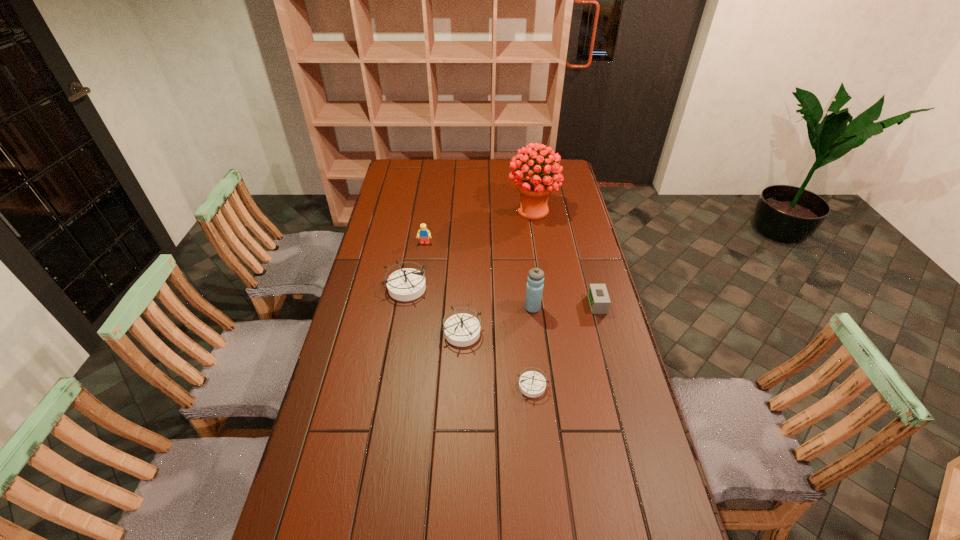
Identify the location of free region located on the front of the farthest compass. (396, 336).

Identify the location of free spot located 0.050m on the back of the fifth object from right to left. The height and width of the screenshot is (540, 960). (463, 306).

This screenshot has width=960, height=540. In order to click on free region located 0.250m on the left of the rightmost compass in this screenshot , I will do `click(434, 385)`.

This screenshot has width=960, height=540. What are the coordinates of `vacant space situated on the back of the bouquet` in the screenshot? It's located at (527, 177).

Where is `vacant space located on the front-facing side of the second farthest object`? The image size is (960, 540). vacant space located on the front-facing side of the second farthest object is located at coordinates (420, 279).

In order to click on vacant space situated on the front-facing side of the rightmost object in this screenshot , I will do `click(486, 305)`.

You are a GUI agent. You are given a task and a screenshot of the screen. Output one action in this format:
    pyautogui.click(x=<x>, y=<y>)
    Task: Click on the vacant area situated 0.130m on the front-facing side of the rightmost object
    This screenshot has height=540, width=960.
    Given the screenshot: What is the action you would take?
    pyautogui.click(x=553, y=305)

You are a GUI agent. You are given a task and a screenshot of the screen. Output one action in this format:
    pyautogui.click(x=<x>, y=<y>)
    Task: Click on the vacant space located 0.400m on the front-facing side of the rightmost object
    
    Given the screenshot: What is the action you would take?
    pyautogui.click(x=477, y=305)

The width and height of the screenshot is (960, 540). What are the coordinates of `vacant space situated 0.200m on the left of the water bottle` in the screenshot? It's located at (468, 308).

I want to click on object at the left edge, so click(407, 284).